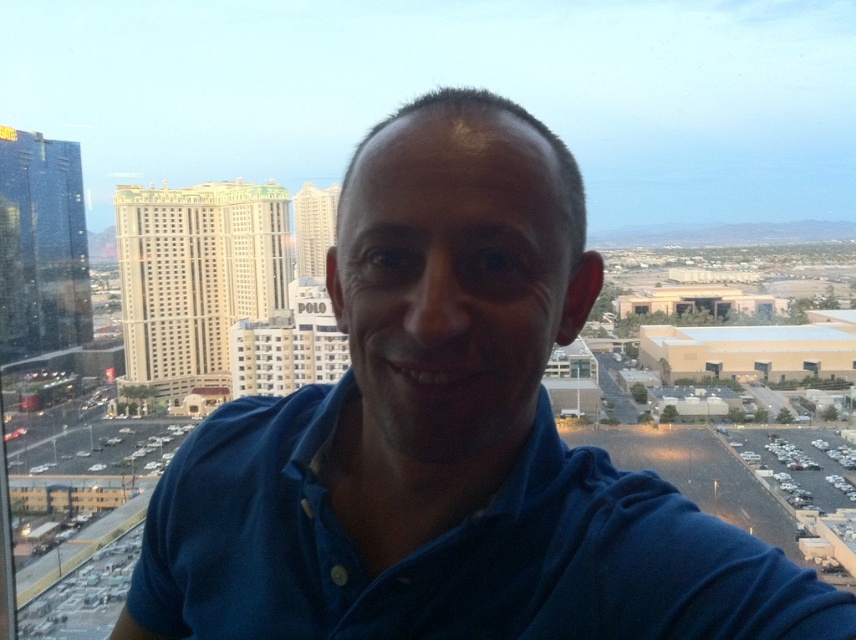
You are standing at the viewpoint where the selfie was taken and want to focus on two specific points in the image. The first point is at coordinates point (421, 243) and the second is at point (520, 445). Which point is nearer to you?

Point (421, 243) is closer to the viewer than point (520, 445).

You are a photographer trying to capture a clear shot of both the blue cotton shirt at center and the blue cotton polo shirt at center in the selfie. Since the two shirts are overlapping, which one should you focus on to ensure the other remains in the background?

You should focus on the blue cotton shirt at center because it is closer to the viewer, which will keep the blue cotton polo shirt at center in the background.

You are a photographer trying to capture a clear shot of both the blue cotton shirt at center and the blue cotton polo shirt at center in the selfie. However, you notice that one of them is blocking the view of the other. Which one is blocking the other?

The blue cotton shirt at center is much taller as blue cotton polo shirt at center, so the blue cotton shirt at center is blocking the view of the blue cotton polo shirt at center.